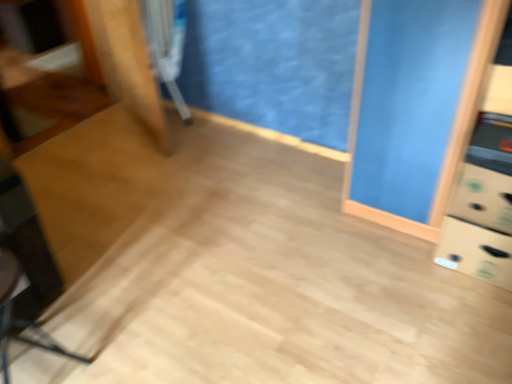
Question: Is black plastic swivel chair at lower left, the 1th swivel chair in the bottom-to-top sequence, wider than metallic silver swivel chair at upper left, arranged as the 1th swivel chair when viewed from the back?

Choices:
 (A) no
 (B) yes

Answer: (B)

Question: From a real-world perspective, is black plastic swivel chair at lower left, marked as the 1th swivel chair in a front-to-back arrangement, located beneath metallic silver swivel chair at upper left, the 2th swivel chair ordered from the bottom?

Choices:
 (A) yes
 (B) no

Answer: (A)

Question: Is black plastic swivel chair at lower left, marked as the 1th swivel chair in a front-to-back arrangement, located outside metallic silver swivel chair at upper left, acting as the 2th swivel chair starting from the front?

Choices:
 (A) yes
 (B) no

Answer: (A)

Question: Is black plastic swivel chair at lower left, marked as the 1th swivel chair in a front-to-back arrangement, positioned with its back to metallic silver swivel chair at upper left, which appears as the 1th swivel chair when viewed from the top?

Choices:
 (A) no
 (B) yes

Answer: (A)

Question: Considering the relative sizes of black plastic swivel chair at lower left, marked as the 1th swivel chair in a front-to-back arrangement, and metallic silver swivel chair at upper left, arranged as the 1th swivel chair when viewed from the back, in the image provided, is black plastic swivel chair at lower left, marked as the 1th swivel chair in a front-to-back arrangement, thinner than metallic silver swivel chair at upper left, arranged as the 1th swivel chair when viewed from the back,?

Choices:
 (A) no
 (B) yes

Answer: (A)

Question: From a real-world perspective, is black plastic swivel chair at lower left, the 1th swivel chair in the bottom-to-top sequence, on metallic silver swivel chair at upper left, arranged as the 1th swivel chair when viewed from the back?

Choices:
 (A) no
 (B) yes

Answer: (A)

Question: Is metallic silver swivel chair at upper left, acting as the 2th swivel chair starting from the front, aimed at black plastic swivel chair at lower left, which is counted as the 2th swivel chair, starting from the top?

Choices:
 (A) yes
 (B) no

Answer: (B)

Question: Can you see metallic silver swivel chair at upper left, acting as the 2th swivel chair starting from the front, touching black plastic swivel chair at lower left, the 1th swivel chair in the bottom-to-top sequence?

Choices:
 (A) no
 (B) yes

Answer: (A)

Question: From a real-world perspective, does metallic silver swivel chair at upper left, which appears as the 1th swivel chair when viewed from the top, stand above black plastic swivel chair at lower left, the 1th swivel chair in the bottom-to-top sequence?

Choices:
 (A) yes
 (B) no

Answer: (A)

Question: Can you confirm if metallic silver swivel chair at upper left, the 2th swivel chair ordered from the bottom, is smaller than black plastic swivel chair at lower left, the 1th swivel chair in the bottom-to-top sequence?

Choices:
 (A) no
 (B) yes

Answer: (A)

Question: Considering the relative sizes of metallic silver swivel chair at upper left, the 2th swivel chair ordered from the bottom, and black plastic swivel chair at lower left, marked as the 1th swivel chair in a front-to-back arrangement, in the image provided, is metallic silver swivel chair at upper left, the 2th swivel chair ordered from the bottom, thinner than black plastic swivel chair at lower left, marked as the 1th swivel chair in a front-to-back arrangement,?

Choices:
 (A) no
 (B) yes

Answer: (B)

Question: Can you confirm if metallic silver swivel chair at upper left, acting as the 2th swivel chair starting from the front, is taller than black plastic swivel chair at lower left, the 1th swivel chair in the bottom-to-top sequence?

Choices:
 (A) no
 (B) yes

Answer: (B)

Question: Based on their positions, is metallic silver swivel chair at upper left, acting as the 2th swivel chair starting from the front, located to the left or right of black plastic swivel chair at lower left, marked as the 1th swivel chair in a front-to-back arrangement?

Choices:
 (A) left
 (B) right

Answer: (B)